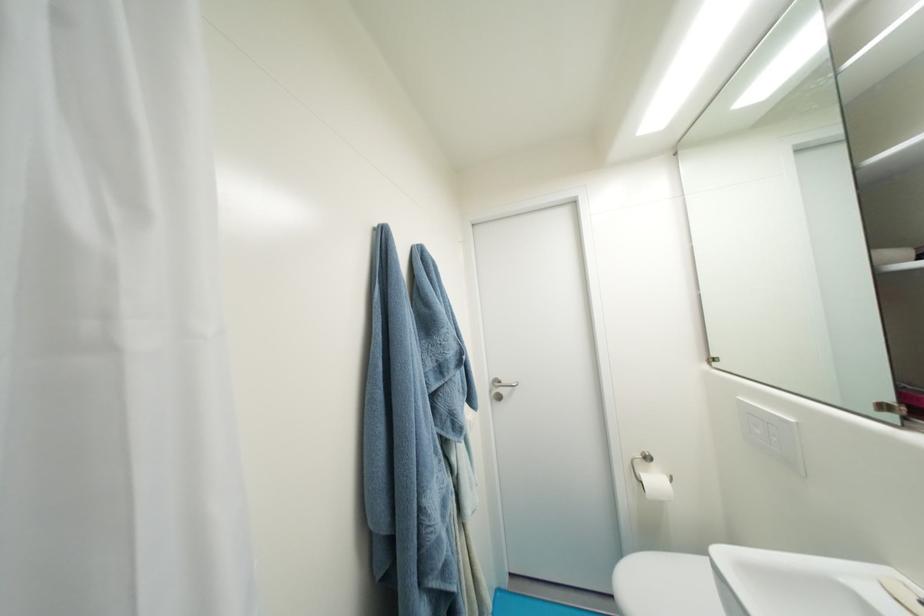
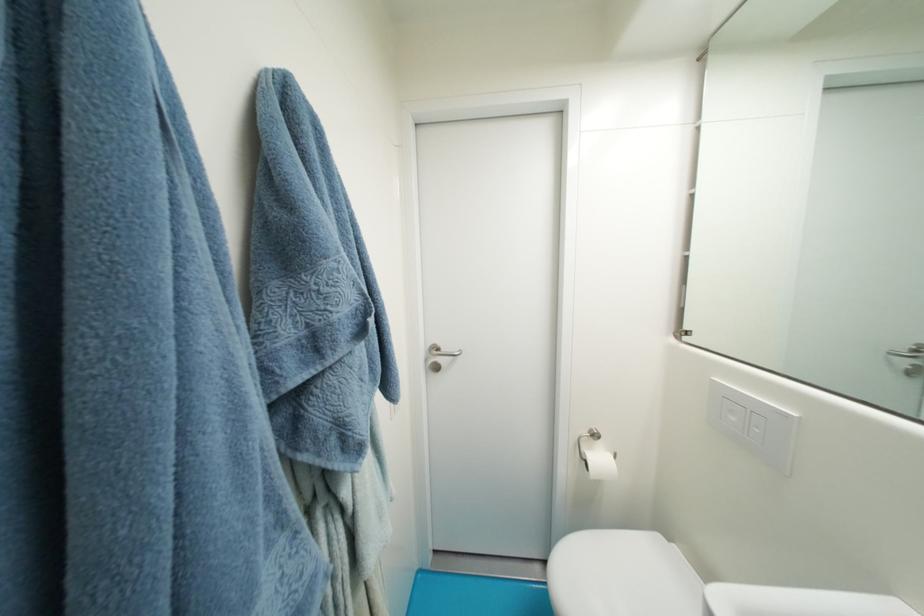
Question: Which direction would the cameraman need to move to produce the second image? Reply with the corresponding letter.

Choices:
 (A) Left
 (B) Right
 (C) Forward
 (D) Backward

Answer: (C)